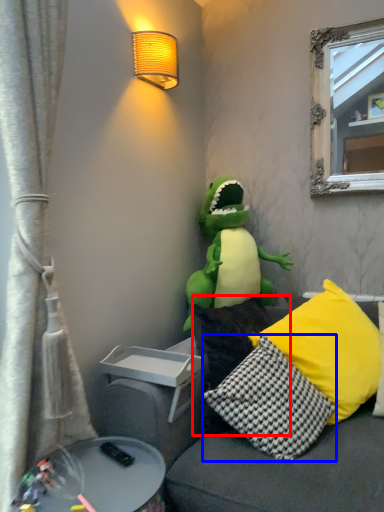
Question: Among these objects, which one is nearest to the camera, pillow (highlighted by a red box) or pillow (highlighted by a blue box)?

Choices:
 (A) pillow
 (B) pillow

Answer: (B)